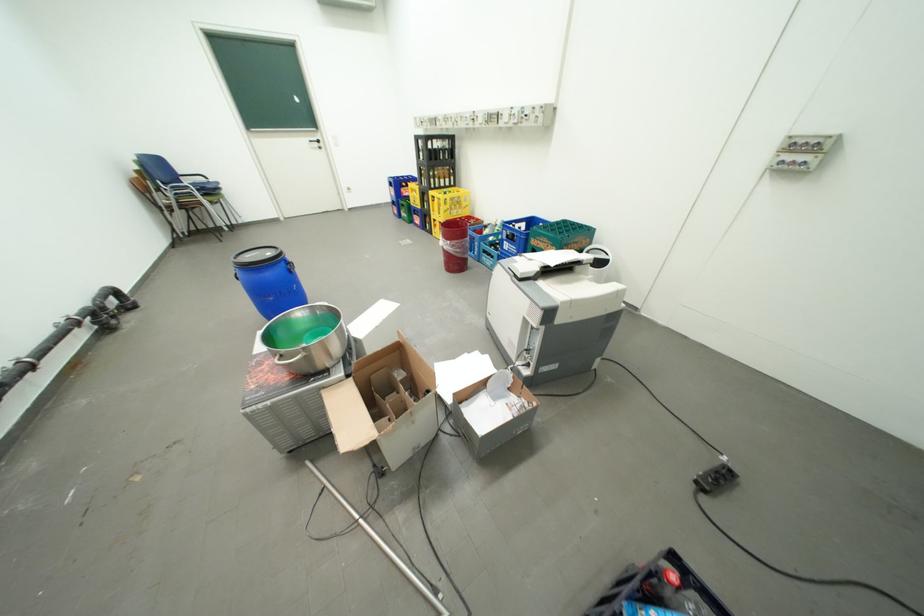
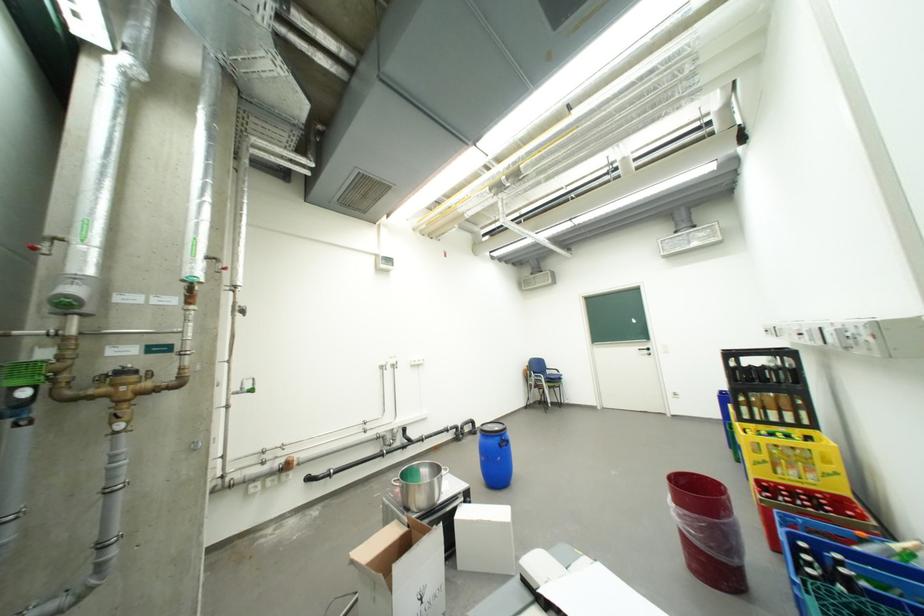
The point at (290, 262) is marked in the first image. Where is the corresponding point in the second image?

(507, 438)